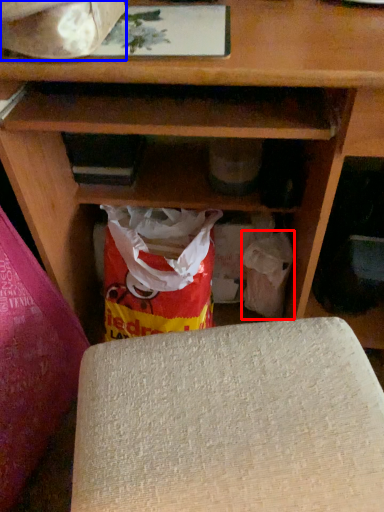
Question: Which object is closer to the camera taking this photo, grocery bag (highlighted by a red box) or wrapping paper (highlighted by a blue box)?

Choices:
 (A) grocery bag
 (B) wrapping paper

Answer: (B)